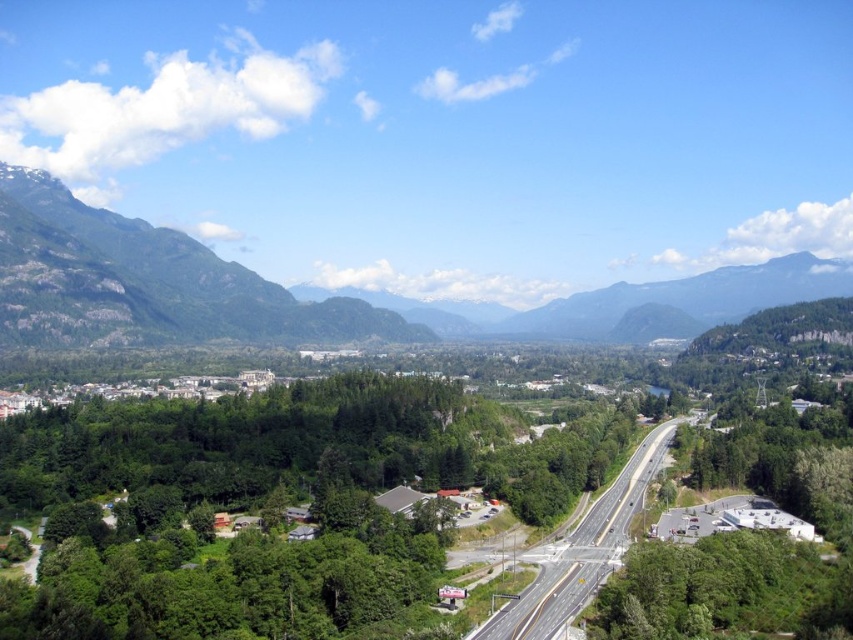
Can you confirm if green rock mountain at upper left is wider than green leafy tree at lower right?

Indeed, green rock mountain at upper left has a greater width compared to green leafy tree at lower right.

Between green rock mountain at upper left and green leafy tree at lower right, which one is positioned higher?

green rock mountain at upper left is higher up.

This screenshot has height=640, width=853. In order to click on green rock mountain at upper left in this screenshot , I will do `click(144, 282)`.

Is point (198, 339) less distant than point (550, 566)?

No, it is behind (550, 566).

Does green rock mountain at upper left have a greater height compared to asphalt road at center?

Correct, green rock mountain at upper left is much taller as asphalt road at center.

This screenshot has width=853, height=640. What do you see at coordinates (144, 282) in the screenshot?
I see `green rock mountain at upper left` at bounding box center [144, 282].

Image resolution: width=853 pixels, height=640 pixels. Find the location of `green rock mountain at upper left`. green rock mountain at upper left is located at coordinates (144, 282).

Between point (709, 572) and point (498, 621), which one is positioned in front?

Positioned in front is point (498, 621).

At what (x,y) coordinates should I click in order to perform the action: click on green leafy tree at lower right. Please return your answer as a coordinate pair (x, y). This screenshot has height=640, width=853. Looking at the image, I should click on (720, 588).